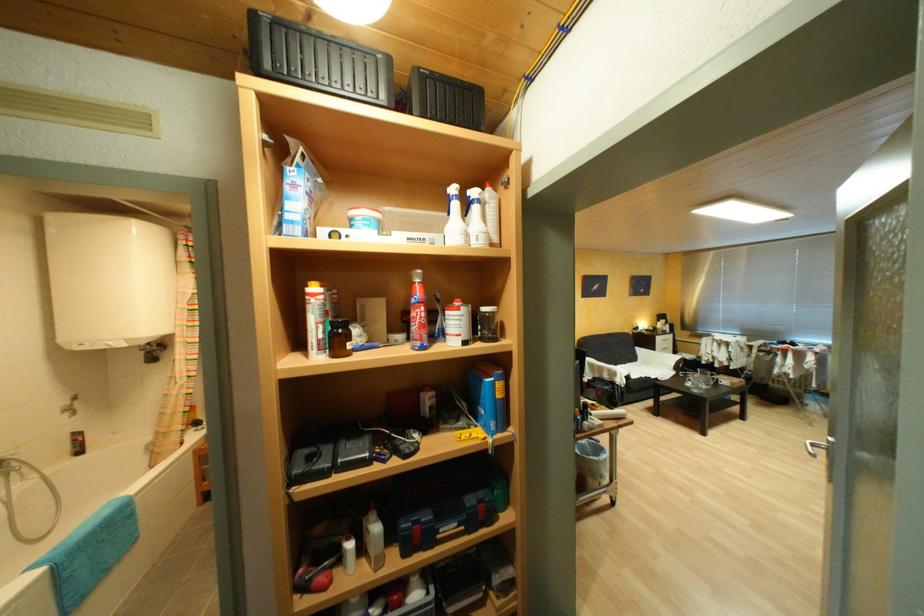
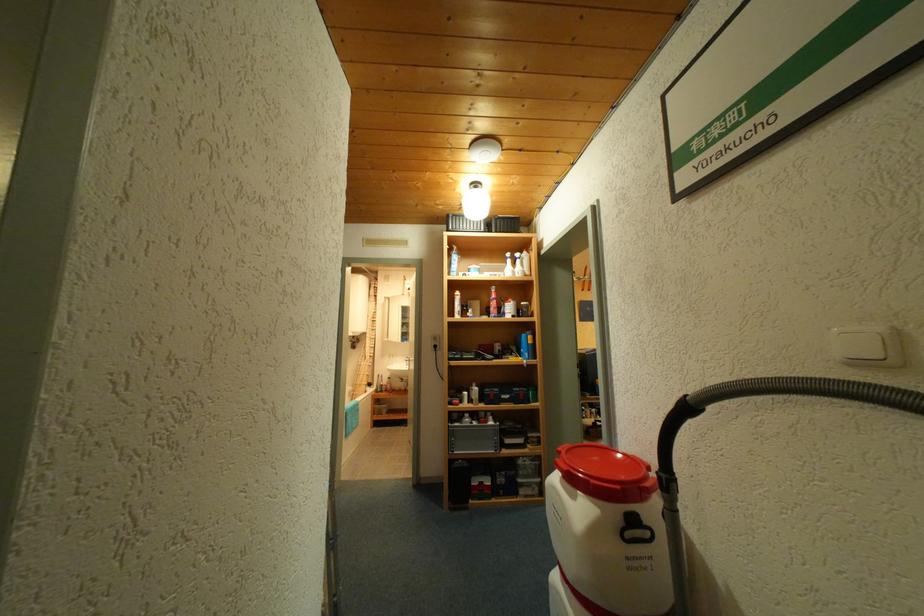
The point at (466, 323) is marked in the first image. Where is the corresponding point in the second image?

(518, 309)